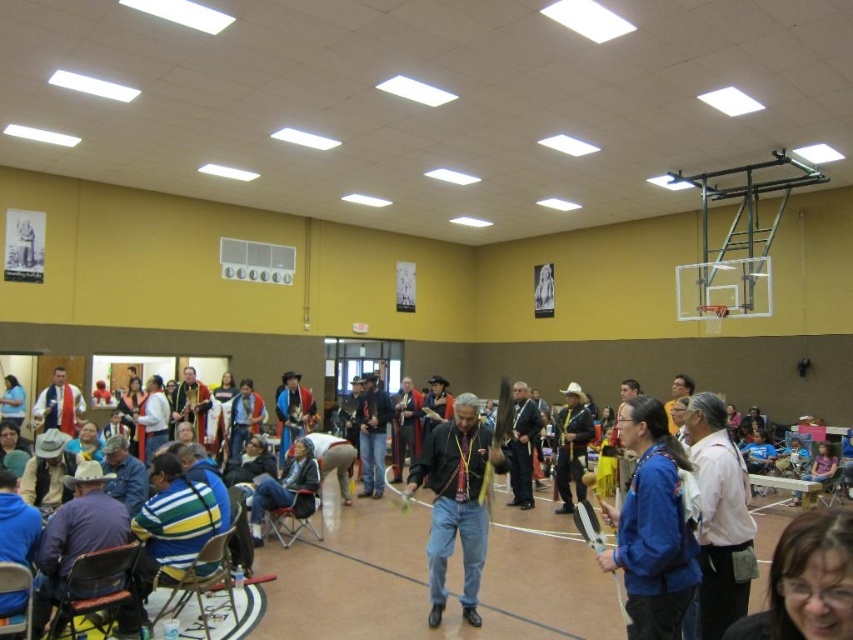
You are a photographer at the event and want to capture a photo of both the leather jacket at center and the dark gray suit at center. Which one is positioned higher in the frame?

The leather jacket at center is positioned higher in the frame because it is located above the dark gray suit at center.

You are standing at the entrance of the gymnasium and want to take a photo of the point marked at coordinate point (x=723, y=612). Considering your camera has a maximum focus range of 10 feet, will you be able to capture the point clearly in your photo?

The point marked at coordinate point (x=723, y=612) is 12.01 feet away from the camera. Since the camera has a maximum focus range of 10 feet, it will not be able to capture the point clearly within that distance.

You are organizing a photo shoot and need to determine which clothing item is narrower between the white cotton shirt at center and the matte white robe at center. Based on the scene description, which one should you choose?

The white cotton shirt at center is narrower than the matte white robe at center, so you should choose the white cotton shirt at center for the photo shoot.